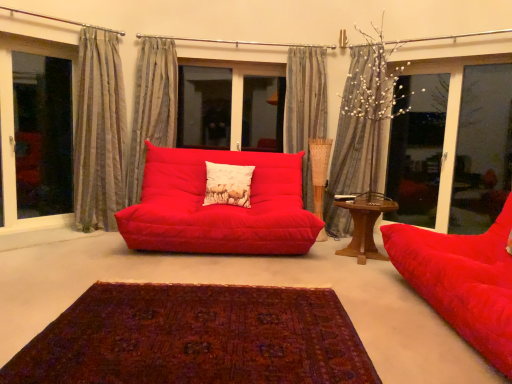
Locate an element on the screen. Image resolution: width=512 pixels, height=384 pixels. free space to the left of matte red beanbag at right, which ranks as the first studio couch in front-to-back order is located at coordinates [x=361, y=304].